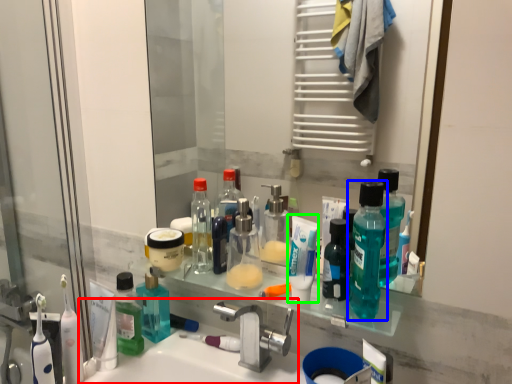
Question: Estimate the real-world distances between objects in this image. Which object is farther from sink (highlighted by a red box), bottle (highlighted by a blue box) or toothpaste (highlighted by a green box)?

Choices:
 (A) bottle
 (B) toothpaste

Answer: (A)